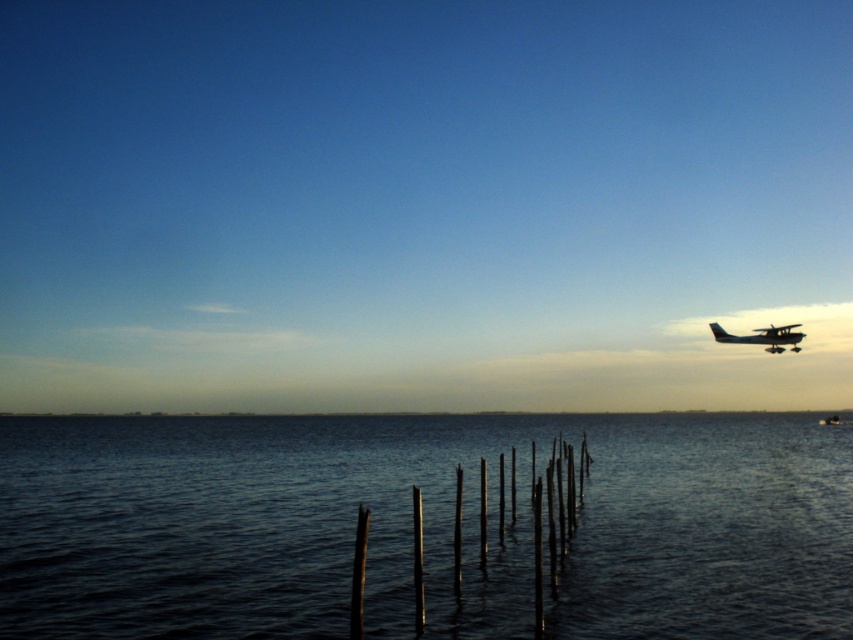
Question: Which object appears closest to the camera in this image?

Choices:
 (A) dark blue water at center
 (B) metallic silver airplane at upper right

Answer: (A)

Question: Can you confirm if dark blue water at center is positioned to the right of metallic silver boat at right?

Choices:
 (A) no
 (B) yes

Answer: (A)

Question: Among these objects, which one is nearest to the camera?

Choices:
 (A) dark blue water at center
 (B) metallic silver airplane at upper right
 (C) metallic silver boat at right

Answer: (A)

Question: Does metallic silver airplane at upper right appear on the right side of metallic silver boat at right?

Choices:
 (A) yes
 (B) no

Answer: (B)

Question: Which point is closer to the camera taking this photo?

Choices:
 (A) (831, 417)
 (B) (630, 572)
 (C) (793, 336)

Answer: (B)

Question: Is dark blue water at center positioned behind metallic silver boat at right?

Choices:
 (A) yes
 (B) no

Answer: (B)